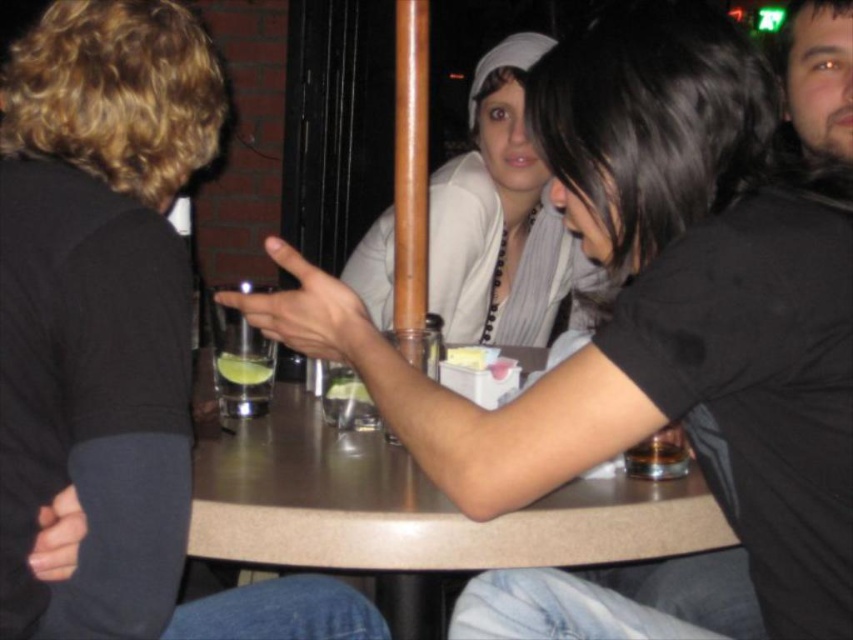
Question: Which point is farther to the camera?

Choices:
 (A) (547, 436)
 (B) (521, 148)
 (C) (158, 429)
 (D) (252, 499)

Answer: (B)

Question: Can you confirm if white matte shirt at center is positioned to the right of green translucent liquid at table center?

Choices:
 (A) yes
 (B) no

Answer: (A)

Question: Does brown laminate table at center appear on the left side of translucent glass at table center?

Choices:
 (A) yes
 (B) no

Answer: (A)

Question: Considering the real-world distances, which object is farthest from the matte white shirt at center?

Choices:
 (A) translucent glass at table center
 (B) brown laminate table at center
 (C) white matte shirt at center
 (D) black matte shirt at center

Answer: (C)

Question: Is black matte shirt at center above white matte shirt at center?

Choices:
 (A) yes
 (B) no

Answer: (B)

Question: Which point is closer to the camera?

Choices:
 (A) brown laminate table at center
 (B) matte white shirt at center
 (C) white matte shirt at center
 (D) black matte shirt at center

Answer: (D)